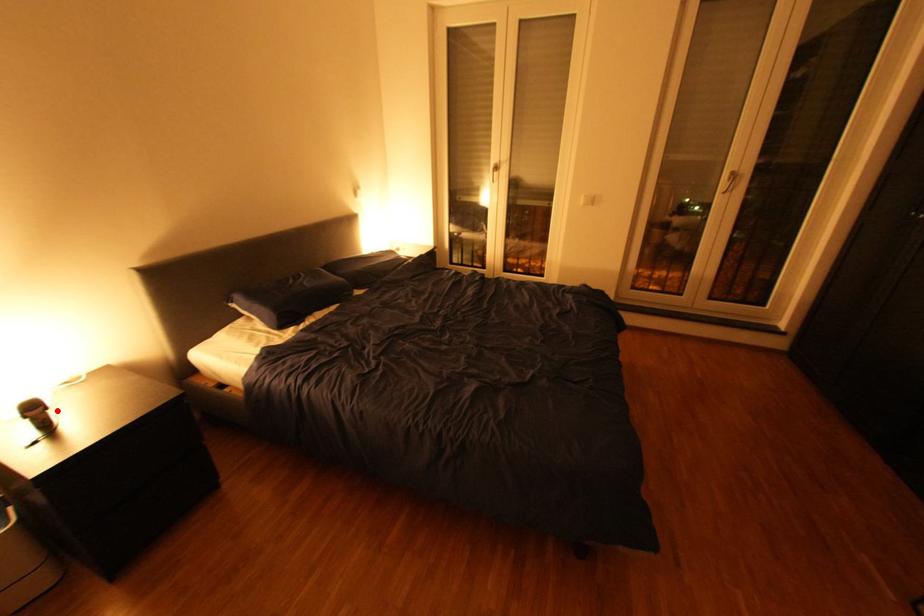
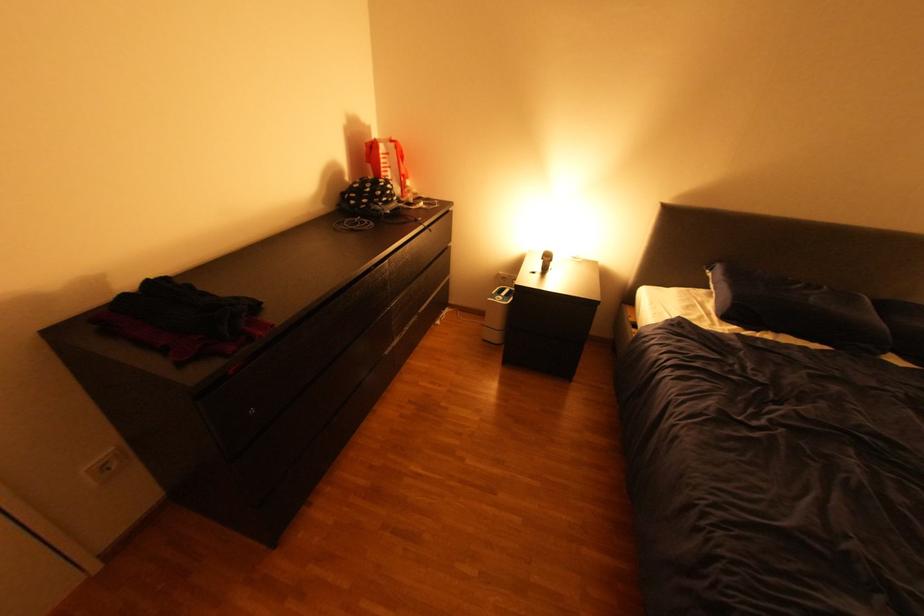
The point at the highlighted location is marked in the first image. Where is the corresponding point in the second image?

(561, 262)